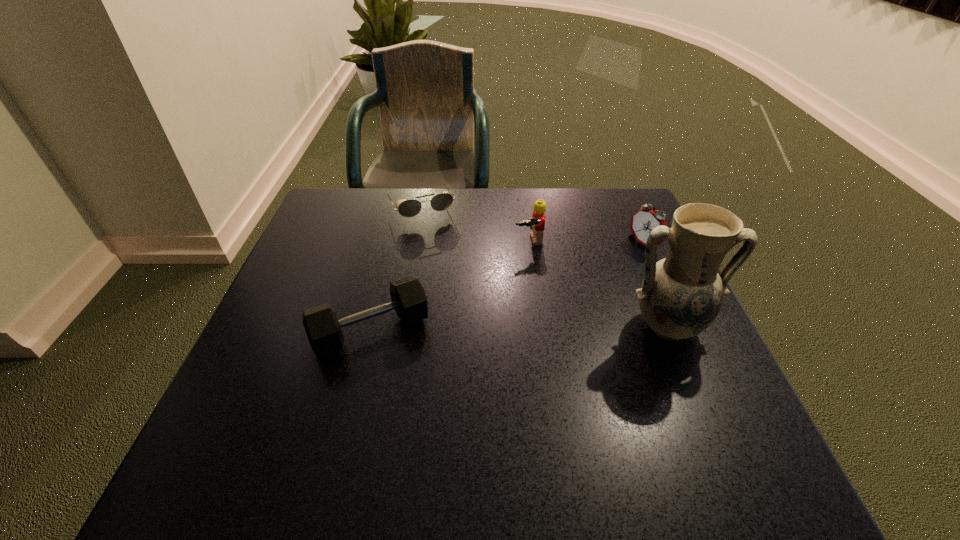
The height and width of the screenshot is (540, 960). I want to click on object positioned at the left edge, so click(x=323, y=329).

This screenshot has width=960, height=540. What are the coordinates of `pottery at the right edge` in the screenshot? It's located at tap(681, 295).

I want to click on alarm clock present at the right edge, so click(x=646, y=219).

Find the location of a particular element. The image size is (960, 540). object that is at the far right corner is located at coordinates (646, 219).

Where is `vacant space at the far edge of the desktop`? This screenshot has height=540, width=960. vacant space at the far edge of the desktop is located at coordinates (474, 235).

Locate an element on the screen. The image size is (960, 540). vacant space at the left edge of the desktop is located at coordinates (347, 287).

The image size is (960, 540). In order to click on free space at the right edge in this screenshot , I will do `click(621, 318)`.

Where is `blank space at the far left corner of the desktop`? blank space at the far left corner of the desktop is located at coordinates (357, 196).

Locate an element on the screen. The height and width of the screenshot is (540, 960). blank space at the far right corner of the desktop is located at coordinates (627, 228).

The image size is (960, 540). I want to click on vacant area that lies between the sunglasses and the fourth tallest object, so click(396, 269).